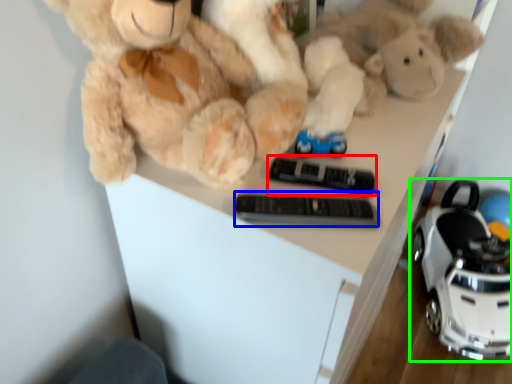
Question: Which object is positioned farthest from control (highlighted by a red box)? Select from control (highlighted by a blue box) and land vehicle (highlighted by a green box).

Choices:
 (A) control
 (B) land vehicle

Answer: (B)